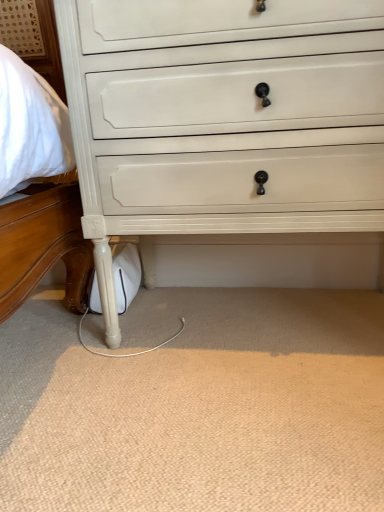
Question: Which direction should I rotate to look at white painted wood chest of drawers at center?

Choices:
 (A) right
 (B) left

Answer: (A)